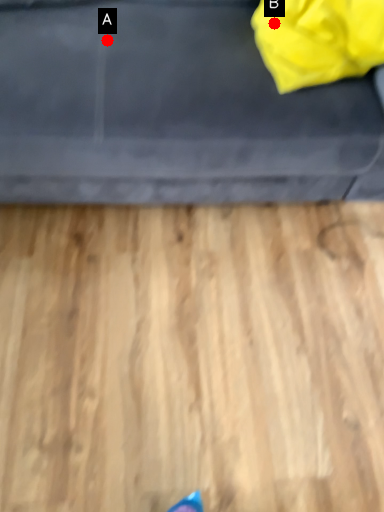
Question: Two points are circled on the image, labeled by A and B beside each circle. Which point appears farthest from the camera in this image?

Choices:
 (A) A is further
 (B) B is further

Answer: (B)